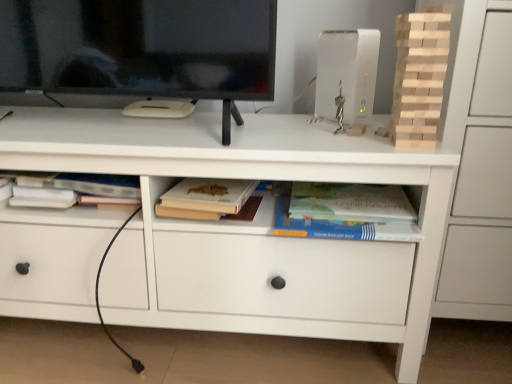
Find the location of a particular element. empty space that is ontop of white matte chest of drawers at center (from a real-world perspective) is located at coordinates (202, 125).